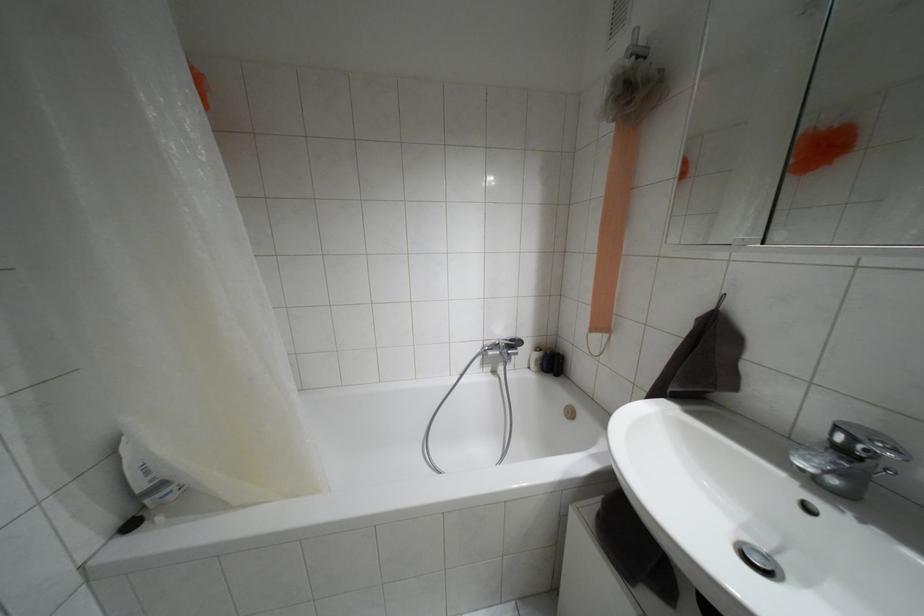
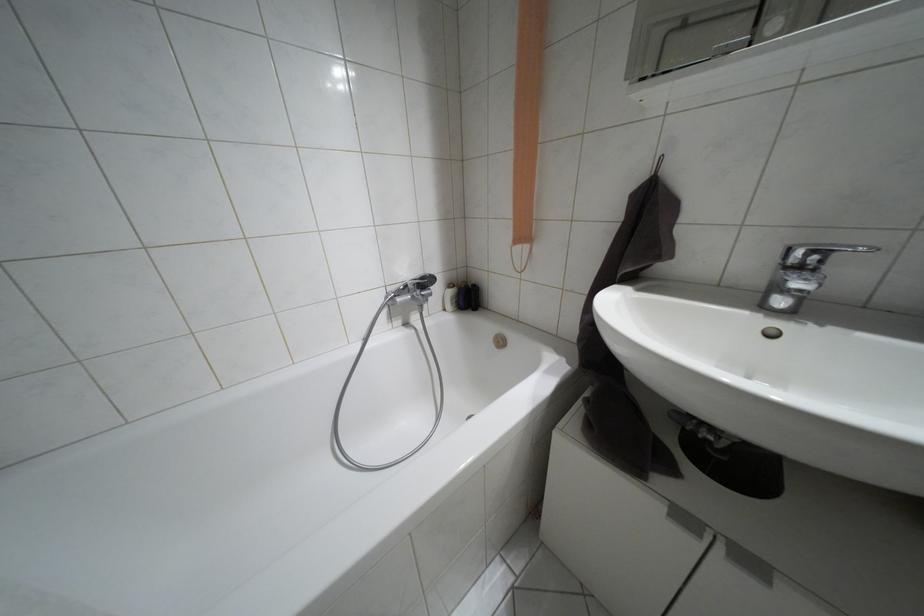
Question: The camera is either moving clockwise (left) or counter-clockwise (right) around the object. The first image is from the beginning of the video and the second image is from the end. Is the camera moving left or right when shooting the video?

Choices:
 (A) Left
 (B) Right

Answer: (A)